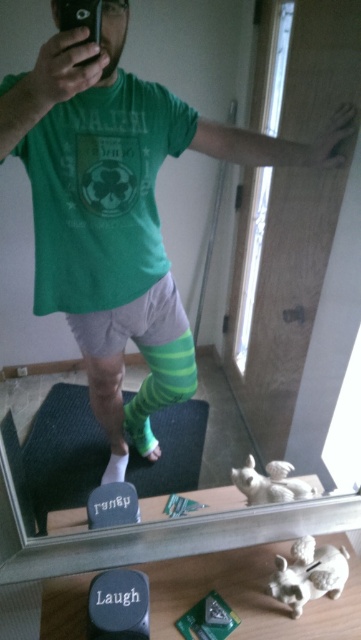
You are trying to decide which sock to wear for a casual day out. Both the green knitted sock at lower center and the green striped sock at lower left are options. Based on their sizes shown in the image, which sock would reach higher up your leg?

The green knitted sock at lower center is much taller than the green striped sock at lower left, so it would reach higher up your leg.

Looking at this image, you are trying to determine if the black plastic phone at upper left can fit into a small pocket that is the same size as the green knitted sock at lower center. Based on their sizes, will it fit?

The black plastic phone at upper left is not as tall as the green knitted sock at lower center, so it should fit into the pocket since it is shorter in height.